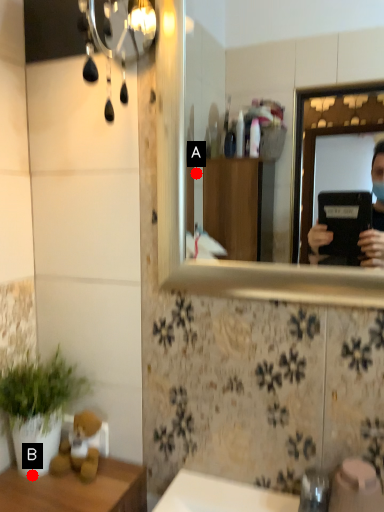
Question: Two points are circled on the image, labeled by A and B beside each circle. Which point is farther to the camera?

Choices:
 (A) A is further
 (B) B is further

Answer: (A)